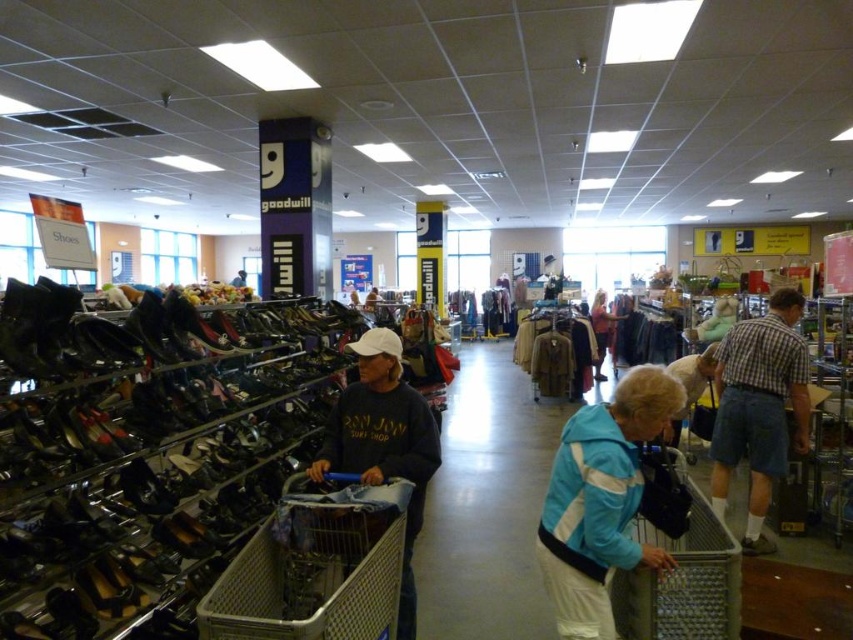
You are a customer in the Goodwill thrift store and want to pick up the dark gray sweatshirt at center. The silver metallic shopping cart at center is blocking your path. Can you walk around the cart to reach the sweatshirt?

The silver metallic shopping cart at center is only 11.11 inches from the dark gray sweatshirt at center. This distance is too small to walk around the cart, so you cannot reach the sweatshirt by going around the cart.